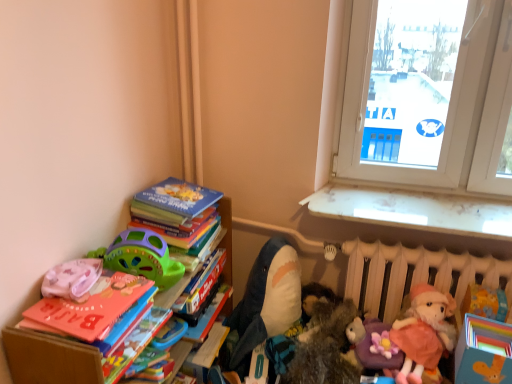
This screenshot has width=512, height=384. Identify the location of space that is in front of pink fabric pillow at left, which is the 1th toy in left-to-right order. (59, 321).